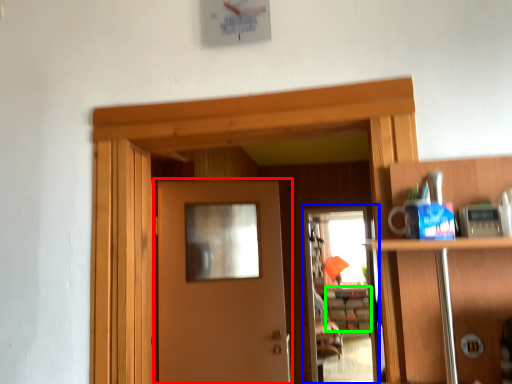
Question: Which is nearer to the door (highlighted by a red box)? screen door (highlighted by a blue box) or cabinetry (highlighted by a green box).

Choices:
 (A) screen door
 (B) cabinetry

Answer: (A)